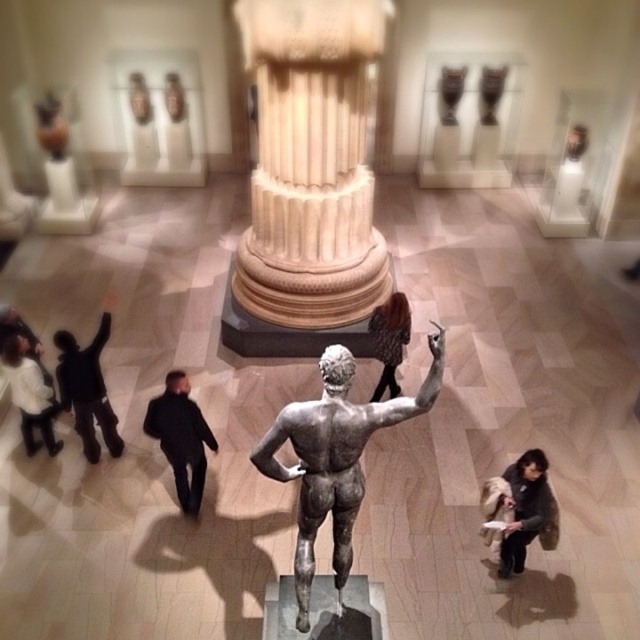
Which is below, bronze statue at center or black matte jacket at left?

bronze statue at center is below.

Does bronze statue at center have a lesser width compared to black matte jacket at left?

In fact, bronze statue at center might be wider than black matte jacket at left.

Describe the element at coordinates (333, 458) in the screenshot. The height and width of the screenshot is (640, 640). I see `bronze statue at center` at that location.

At what (x,y) coordinates should I click in order to perform the action: click on bronze statue at center. Please return your answer as a coordinate pair (x, y). Looking at the image, I should click on (333, 458).

Between white marble column at center and black matte jacket at lower center, which one appears on the right side from the viewer's perspective?

From the viewer's perspective, white marble column at center appears more on the right side.

This screenshot has width=640, height=640. Describe the element at coordinates (310, 163) in the screenshot. I see `white marble column at center` at that location.

Does point (353, 209) lie in front of point (186, 435)?

No, (353, 209) is further to viewer.

The width and height of the screenshot is (640, 640). I want to click on white marble column at center, so click(310, 163).

Is point (545, 528) positioned after point (26, 368)?

No, it is not.

Who is positioned more to the left, dark brown fur coat at lower right or white cotton jacket at lower left?

white cotton jacket at lower left is more to the left.

Describe the element at coordinates (520, 509) in the screenshot. I see `dark brown fur coat at lower right` at that location.

You are a GUI agent. You are given a task and a screenshot of the screen. Output one action in this format:
    pyautogui.click(x=<x>, y=<y>)
    Task: Click on the dark brown fur coat at lower right
    
    Given the screenshot: What is the action you would take?
    pyautogui.click(x=520, y=509)